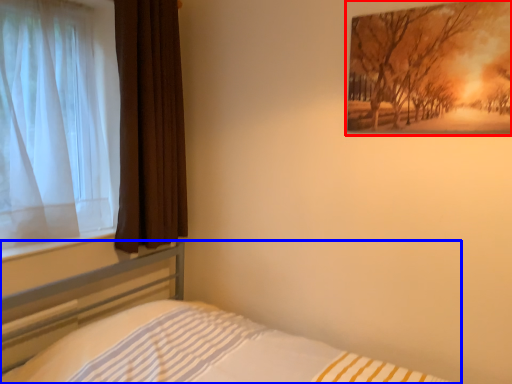
Question: Which of the following is the farthest to the observer, picture frame (highlighted by a red box) or bed (highlighted by a blue box)?

Choices:
 (A) picture frame
 (B) bed

Answer: (A)